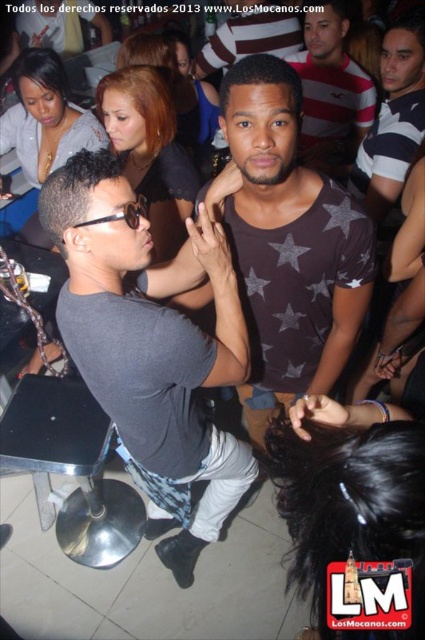
Does point (212, 225) come farther from viewer compared to point (331, 236)?

That is False.

Is gray matte t-shirt at center taller than dark gray star-patterned shirt at center?

Yes.

This screenshot has width=425, height=640. What are the coordinates of `gray matte t-shirt at center` in the screenshot? It's located at (150, 339).

This screenshot has width=425, height=640. I want to click on gray matte t-shirt at center, so [x=150, y=339].

Does point (141, 333) lie behind point (322, 132)?

No, (141, 333) is closer to viewer.

How much distance is there between gray matte t-shirt at center and gray striped shirt at center?

A distance of 1.94 meters exists between gray matte t-shirt at center and gray striped shirt at center.

You are a GUI agent. You are given a task and a screenshot of the screen. Output one action in this format:
    pyautogui.click(x=<x>, y=<y>)
    Task: Click on the gray matte t-shirt at center
    Image resolution: width=425 pixels, height=640 pixels.
    Given the screenshot: What is the action you would take?
    pyautogui.click(x=150, y=339)

Between point (248, 268) and point (408, 90), which one is positioned behind?

The point (408, 90) is behind.

Between dark gray star-patterned shirt at center and striped cotton shirt at upper right, which one has more height?

dark gray star-patterned shirt at center

Where is `dark gray star-patterned shirt at center`? The width and height of the screenshot is (425, 640). dark gray star-patterned shirt at center is located at coordinates (289, 244).